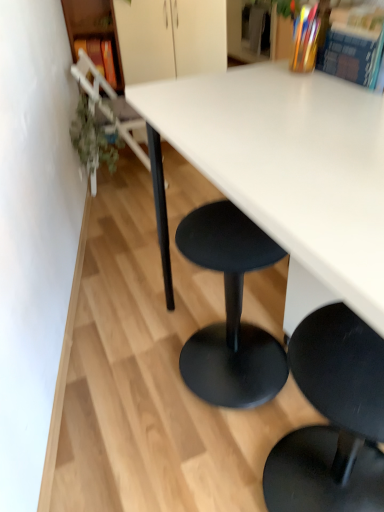
Question: From the image's perspective, is white matte table at center beneath wooden bookshelf at left?

Choices:
 (A) yes
 (B) no

Answer: (A)

Question: Are white matte table at center and wooden bookshelf at left located far from each other?

Choices:
 (A) yes
 (B) no

Answer: (A)

Question: Is white matte table at center closer to camera compared to wooden bookshelf at left?

Choices:
 (A) yes
 (B) no

Answer: (A)

Question: Does white matte table at center contain wooden bookshelf at left?

Choices:
 (A) yes
 (B) no

Answer: (B)

Question: Could you tell me if white matte table at center is facing wooden bookshelf at left?

Choices:
 (A) no
 (B) yes

Answer: (A)

Question: Considering the relative positions of white matte table at center and wooden bookshelf at left in the image provided, is white matte table at center to the right of wooden bookshelf at left from the viewer's perspective?

Choices:
 (A) yes
 (B) no

Answer: (A)

Question: Does hardcover book at upper right, placed as the third book when sorted from back to front, have a greater width compared to green leafy plant at left?

Choices:
 (A) yes
 (B) no

Answer: (B)

Question: Is hardcover book at upper right, acting as the first book starting from the bottom, to the right of green leafy plant at left from the viewer's perspective?

Choices:
 (A) no
 (B) yes

Answer: (B)

Question: Does hardcover book at upper right, which ranks as the 3th book in top-to-bottom order, lie behind green leafy plant at left?

Choices:
 (A) yes
 (B) no

Answer: (B)

Question: Does hardcover book at upper right, which ranks as the 3th book in top-to-bottom order, have a greater height compared to green leafy plant at left?

Choices:
 (A) yes
 (B) no

Answer: (B)

Question: From the image's perspective, is hardcover book at upper right, the third book in the left-to-right sequence, above green leafy plant at left?

Choices:
 (A) no
 (B) yes

Answer: (A)

Question: Is hardcover book at upper right, placed as the third book when sorted from back to front, not inside green leafy plant at left?

Choices:
 (A) yes
 (B) no

Answer: (A)

Question: Does green leafy plant at left have a lesser height compared to white matte table at center?

Choices:
 (A) no
 (B) yes

Answer: (B)